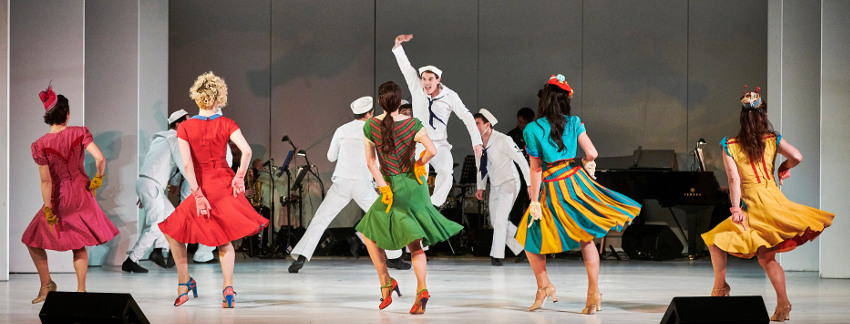
Locate an element on the screen. equipment wires and stands is located at coordinates (312, 191), (326, 177), (301, 200), (286, 173), (273, 184), (256, 186).